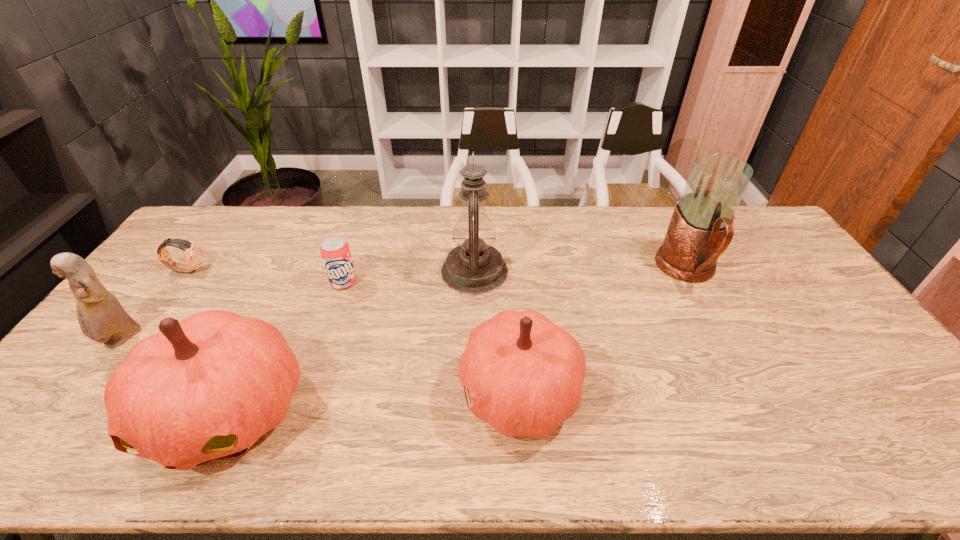
Where is `the taller pumpkin`? the taller pumpkin is located at coordinates (209, 387).

Where is `the right pumpkin`? the right pumpkin is located at coordinates (524, 374).

At what (x,y) coordinates should I click in order to perform the action: click on the shortest object. Please return your answer as a coordinate pair (x, y). Looking at the image, I should click on (194, 254).

At what (x,y) coordinates should I click in order to perform the action: click on pitcher. Please return your answer as a coordinate pair (x, y). This screenshot has height=540, width=960. Looking at the image, I should click on (701, 228).

Image resolution: width=960 pixels, height=540 pixels. Identify the location of the sixth tallest object. (335, 252).

Where is `figurine`? The height and width of the screenshot is (540, 960). figurine is located at coordinates (101, 317).

The image size is (960, 540). Identify the location of oil lamp. (474, 267).

The height and width of the screenshot is (540, 960). I want to click on free space located on the front-facing side of the shorter pumpkin, so click(438, 392).

I want to click on blank space located 0.370m on the front-facing side of the shorter pumpkin, so click(x=310, y=392).

Where is `vacant space located on the front-facing side of the shorter pumpkin`? The image size is (960, 540). vacant space located on the front-facing side of the shorter pumpkin is located at coordinates (378, 392).